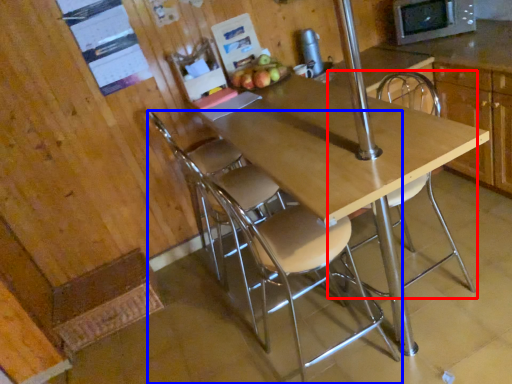
Question: Which object appears farthest to the camera in this image, chair (highlighted by a red box) or chair (highlighted by a blue box)?

Choices:
 (A) chair
 (B) chair

Answer: (A)